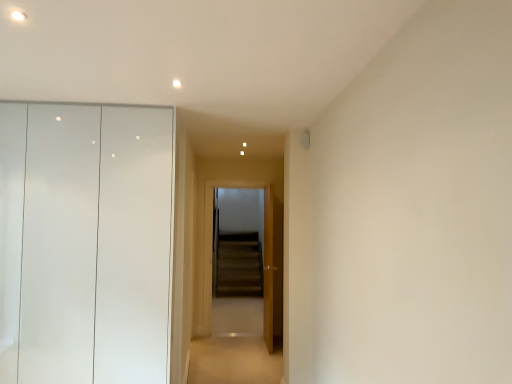
Question: From the image's perspective, would you say carpeted floor at center is positioned over matte white dresser at left?

Choices:
 (A) no
 (B) yes

Answer: (A)

Question: Is carpeted floor at center positioned with its back to matte white dresser at left?

Choices:
 (A) no
 (B) yes

Answer: (A)

Question: Would you say carpeted floor at center is outside matte white dresser at left?

Choices:
 (A) no
 (B) yes

Answer: (B)

Question: Does carpeted floor at center come in front of matte white dresser at left?

Choices:
 (A) no
 (B) yes

Answer: (A)

Question: Does carpeted floor at center have a larger size compared to matte white dresser at left?

Choices:
 (A) yes
 (B) no

Answer: (B)

Question: Does carpeted floor at center have a smaller size compared to matte white dresser at left?

Choices:
 (A) yes
 (B) no

Answer: (A)

Question: From the image's perspective, is matte white dresser at left above wooden door at center?

Choices:
 (A) no
 (B) yes

Answer: (B)

Question: Is matte white dresser at left aimed at wooden door at center?

Choices:
 (A) yes
 (B) no

Answer: (B)

Question: From a real-world perspective, is matte white dresser at left under wooden door at center?

Choices:
 (A) yes
 (B) no

Answer: (B)

Question: Would you say wooden door at center is part of matte white dresser at left's contents?

Choices:
 (A) no
 (B) yes

Answer: (A)

Question: Can you confirm if matte white dresser at left is positioned to the left of wooden door at center?

Choices:
 (A) no
 (B) yes

Answer: (B)

Question: Is matte white dresser at left outside wooden door at center?

Choices:
 (A) no
 (B) yes

Answer: (B)

Question: Is wooden screen door at center at the right side of wooden door at center?

Choices:
 (A) yes
 (B) no

Answer: (B)